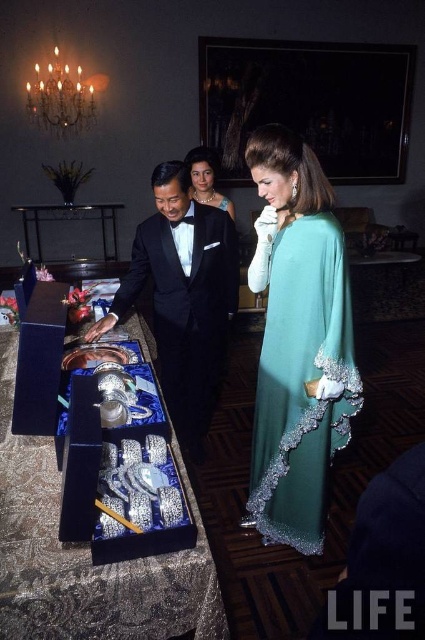
Is point (294, 314) positioned in front of point (187, 227)?

Yes, it is in front of point (187, 227).

Identify the location of teal satin dress at right. point(300,376).

Can you confirm if shiny silver tray at center is positioned above black satin tuxedo at center?

Incorrect, shiny silver tray at center is not positioned above black satin tuxedo at center.

Does point (170, 620) lie behind point (164, 264)?

No, (170, 620) is in front of (164, 264).

Is point (124, 588) farther from camera compared to point (166, 387)?

No, (124, 588) is in front of (166, 387).

The width and height of the screenshot is (425, 640). Find the location of `shiny silver tray at center`. shiny silver tray at center is located at coordinates (87, 556).

Is black satin tuxedo at center smaller than matte black dress at center?

Incorrect, black satin tuxedo at center is not smaller in size than matte black dress at center.

Is black satin tuxedo at center to the right of matte black dress at center from the viewer's perspective?

No, black satin tuxedo at center is not to the right of matte black dress at center.

Image resolution: width=425 pixels, height=640 pixels. Find the location of `black satin tuxedo at center`. black satin tuxedo at center is located at coordinates (184, 296).

Identify the location of black satin tuxedo at center. (184, 296).